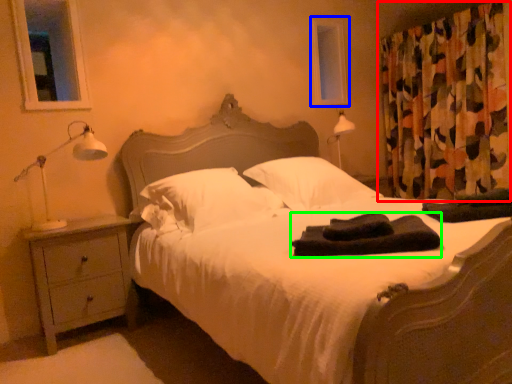
Question: Which object is the farthest from curtain (highlighted by a red box)? Choose among these: window screen (highlighted by a blue box) or material (highlighted by a green box).

Choices:
 (A) window screen
 (B) material

Answer: (B)